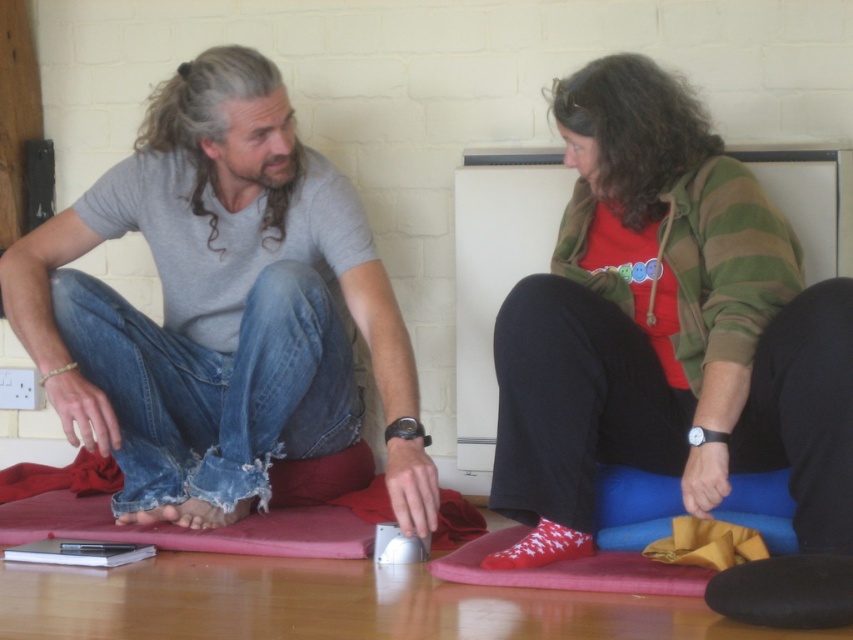
Does matte gray t-shirt at center appear on the left side of red socks at center?

Correct, you'll find matte gray t-shirt at center to the left of red socks at center.

Is matte gray t-shirt at center closer to the viewer compared to red socks at center?

No, it is not.

Which is in front, point (167, 362) or point (582, 465)?

Point (582, 465) is in front.

At what (x,y) coordinates should I click in order to perform the action: click on matte gray t-shirt at center. Please return your answer as a coordinate pair (x, y). The height and width of the screenshot is (640, 853). Looking at the image, I should click on (219, 308).